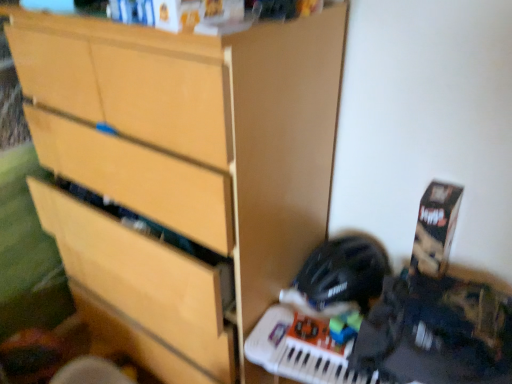
Image resolution: width=512 pixels, height=384 pixels. Describe the element at coordinates (343, 272) in the screenshot. I see `black matte helmet at lower right` at that location.

Find the location of a particular element. Image resolution: width=512 pixels, height=384 pixels. black matte helmet at lower right is located at coordinates (343, 272).

The image size is (512, 384). Find the location of `matte wood chest of drawers at center`. matte wood chest of drawers at center is located at coordinates (182, 174).

What do you see at coordinates (182, 174) in the screenshot?
I see `matte wood chest of drawers at center` at bounding box center [182, 174].

The height and width of the screenshot is (384, 512). I want to click on black matte helmet at lower right, so click(x=343, y=272).

Between black matte helmet at lower right and matte wood chest of drawers at center, which one appears on the left side from the viewer's perspective?

matte wood chest of drawers at center.

Relative to matte wood chest of drawers at center, is black matte helmet at lower right in front or behind?

black matte helmet at lower right is behind matte wood chest of drawers at center.

From the picture: Which is closer, (388, 263) or (210, 76)?

Point (210, 76)

From the image's perspective, is black matte helmet at lower right located beneath matte wood chest of drawers at center?

Yes.

From a real-world perspective, who is located higher, black matte helmet at lower right or matte wood chest of drawers at center?

matte wood chest of drawers at center, from a real-world perspective.

Is black matte helmet at lower right wider than matte wood chest of drawers at center?

Incorrect, the width of black matte helmet at lower right does not surpass that of matte wood chest of drawers at center.

Considering the relative sizes of black matte helmet at lower right and matte wood chest of drawers at center in the image provided, is black matte helmet at lower right shorter than matte wood chest of drawers at center?

Correct, black matte helmet at lower right is not as tall as matte wood chest of drawers at center.

Considering the relative sizes of black matte helmet at lower right and matte wood chest of drawers at center in the image provided, is black matte helmet at lower right bigger than matte wood chest of drawers at center?

No, black matte helmet at lower right is not bigger than matte wood chest of drawers at center.

Based on the photo, is matte wood chest of drawers at center completely or partially inside black matte helmet at lower right?

No, matte wood chest of drawers at center is not a part of black matte helmet at lower right.

Is black matte helmet at lower right in contact with matte wood chest of drawers at center?

They are not placed beside each other.

Is matte wood chest of drawers at center at the back of black matte helmet at lower right?

That's not correct — black matte helmet at lower right is not looking away from matte wood chest of drawers at center.

What's the angular difference between black matte helmet at lower right and matte wood chest of drawers at center's facing directions?

The facing directions of black matte helmet at lower right and matte wood chest of drawers at center are 5.38 degrees apart.

This screenshot has width=512, height=384. I want to click on the chest of drawers that appears in front of the black matte helmet at lower right, so click(182, 174).

Considering the positions of objects matte wood chest of drawers at center and black matte helmet at lower right in the image provided, who is more to the left, matte wood chest of drawers at center or black matte helmet at lower right?

Positioned to the left is matte wood chest of drawers at center.

Which object is closer to the camera, matte wood chest of drawers at center or black matte helmet at lower right?

matte wood chest of drawers at center.

Does point (168, 308) appear closer or farther from the camera than point (366, 291)?

Point (168, 308) is closer to the camera than point (366, 291).

From the image's perspective, which one is positioned lower, matte wood chest of drawers at center or black matte helmet at lower right?

From the image's view, black matte helmet at lower right is below.

Looking at this image, from a real-world perspective, is matte wood chest of drawers at center positioned above or below black matte helmet at lower right?

matte wood chest of drawers at center is above black matte helmet at lower right.

Based on the photo, can you confirm if matte wood chest of drawers at center is wider than black matte helmet at lower right?

Yes.

Does matte wood chest of drawers at center have a greater height compared to black matte helmet at lower right?

Yes.

Which of these two, matte wood chest of drawers at center or black matte helmet at lower right, is bigger?

matte wood chest of drawers at center.

Would you say matte wood chest of drawers at center contains black matte helmet at lower right?

No, black matte helmet at lower right is not inside matte wood chest of drawers at center.

Is matte wood chest of drawers at center directly adjacent to black matte helmet at lower right?

matte wood chest of drawers at center and black matte helmet at lower right are not in contact.

Is matte wood chest of drawers at center oriented towards black matte helmet at lower right?

No, matte wood chest of drawers at center is not oriented towards black matte helmet at lower right.

Can you tell me how much matte wood chest of drawers at center and black matte helmet at lower right differ in facing direction?

The facing directions of matte wood chest of drawers at center and black matte helmet at lower right are 5.38 degrees apart.

The height and width of the screenshot is (384, 512). What are the coordinates of `helmet below the matte wood chest of drawers at center (from the image's perspective)` in the screenshot? It's located at (343, 272).

In the image, there is a black matte helmet at lower right. Where is `the chest of drawers above it (from the image's perspective)`? Image resolution: width=512 pixels, height=384 pixels. the chest of drawers above it (from the image's perspective) is located at coordinates tap(182, 174).

Where is `helmet behind the matte wood chest of drawers at center`? This screenshot has height=384, width=512. helmet behind the matte wood chest of drawers at center is located at coordinates (343, 272).